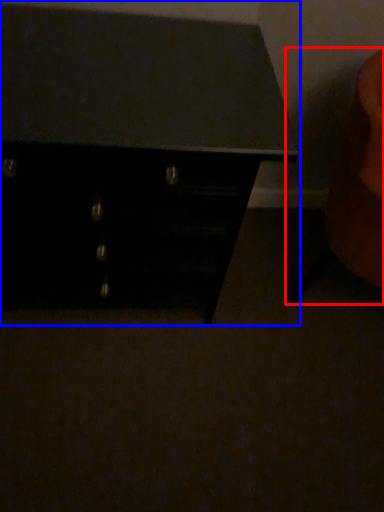
Question: Which object is closer to the camera taking this photo, swivel chair (highlighted by a red box) or chest of drawers (highlighted by a blue box)?

Choices:
 (A) swivel chair
 (B) chest of drawers

Answer: (B)